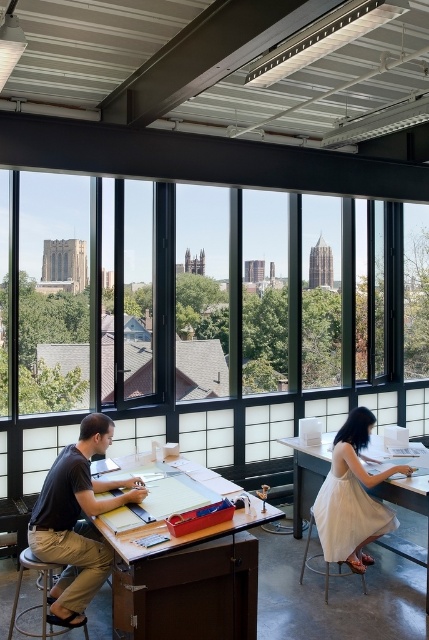
Question: Among these objects, which one is farthest from the camera?

Choices:
 (A) dark brown leather stool at lower left
 (B) white fabric table at lower right
 (C) metallic stool at lower left
 (D) white cotton dress at center

Answer: (B)

Question: Which point is farther from the camera taking this photo?

Choices:
 (A) click(378, 492)
 (B) click(331, 339)

Answer: (B)

Question: Does white cotton dress at center come behind metallic stool at lower left?

Choices:
 (A) no
 (B) yes

Answer: (B)

Question: Is white cotton dress at center thinner than white fabric table at lower right?

Choices:
 (A) no
 (B) yes

Answer: (A)

Question: Which object is the closest to the white fabric table at lower right?

Choices:
 (A) white cotton dress at center
 (B) transparent glass window at upper center

Answer: (A)

Question: Can you confirm if transparent glass window at upper center is positioned to the left of dark brown leather stool at lower left?

Choices:
 (A) yes
 (B) no

Answer: (B)